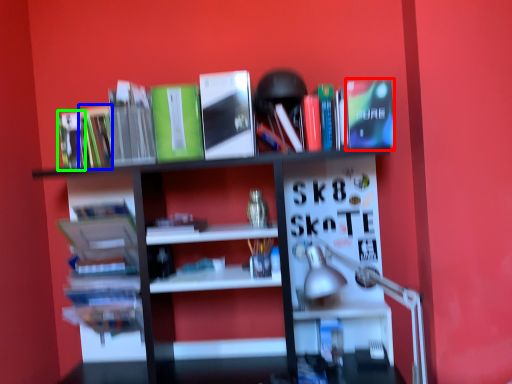
Question: Which object is the farthest from paperback book (highlighted by a red box)? Choose among these: book (highlighted by a blue box) or book (highlighted by a green box).

Choices:
 (A) book
 (B) book

Answer: (B)